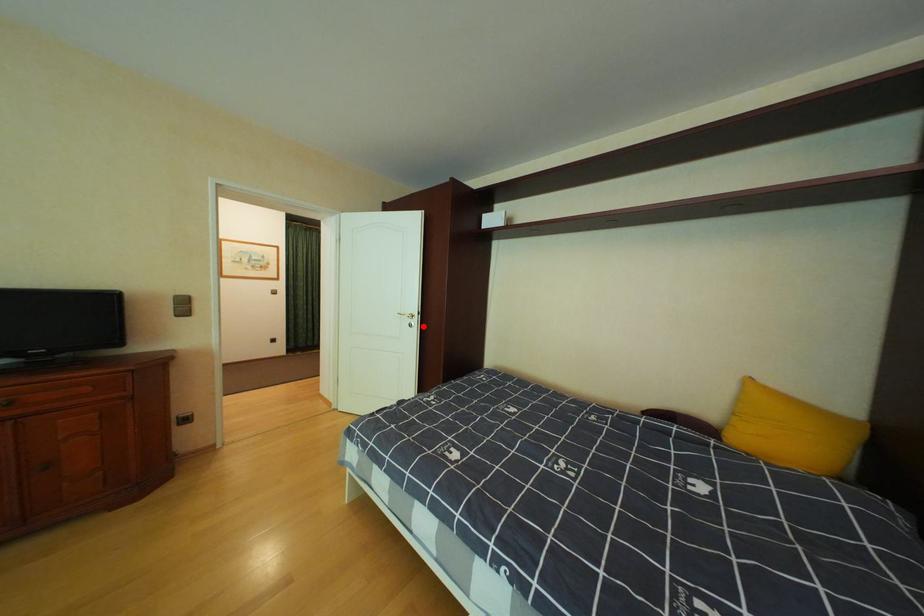
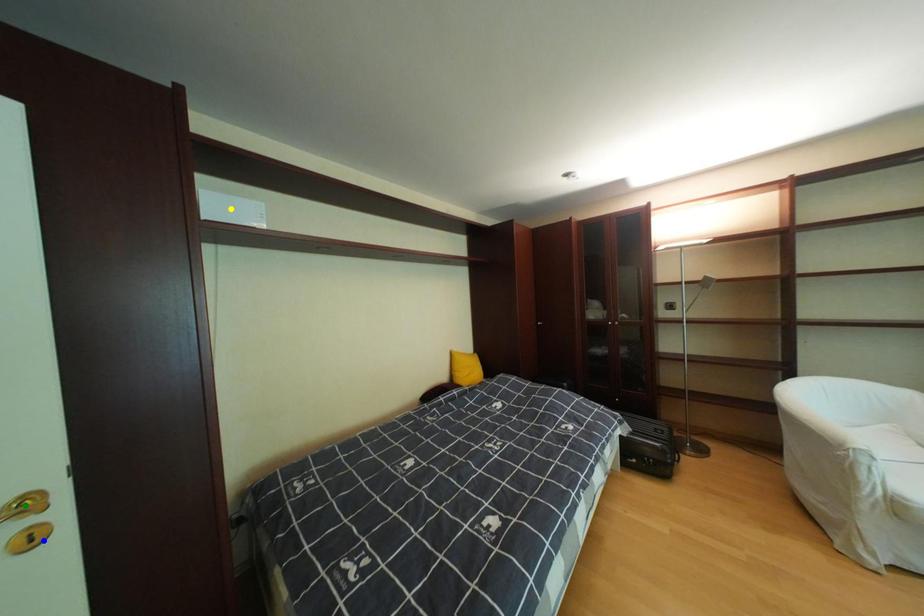
Question: I am providing you with two images of the same scene from different viewpoints. A red point is marked on the first image. You are given multiple points on the second image. Which point in image 2 is actually the same real-world point as the red point in image 1?

Choices:
 (A) green point
 (B) yellow point
 (C) blue point

Answer: (C)